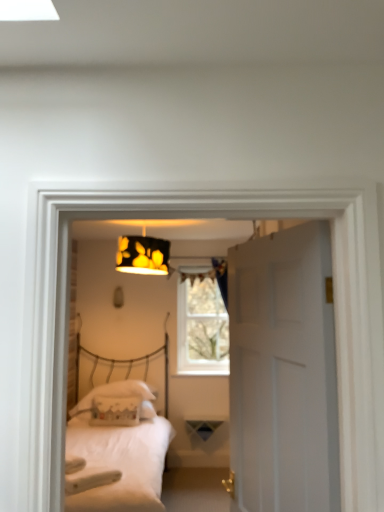
Question: From a real-world perspective, is white fabric pillow at center, the 1th pillow when ordered from back to front, physically located above or below white matte bed at center?

Choices:
 (A) above
 (B) below

Answer: (B)

Question: Relative to white matte bed at center, is white fabric pillow at center, marked as the second pillow in a front-to-back arrangement, in front or behind?

Choices:
 (A) behind
 (B) front

Answer: (A)

Question: Which object is the closest to the clear glass window at center?

Choices:
 (A) white matte bed at center
 (B) white matte door at center
 (C) white fabric pillow at center, marked as the second pillow in a front-to-back arrangement
 (D) white fabric pillow at center, the first pillow from the front
 (E) black paper lampshade at upper center

Answer: (C)

Question: Which object is positioned farthest from the white fabric pillow at center, marked as the second pillow in a front-to-back arrangement?

Choices:
 (A) clear glass window at center
 (B) black paper lampshade at upper center
 (C) white matte bed at center
 (D) white matte door at center
 (E) white fabric pillow at center, the first pillow from the front

Answer: (D)